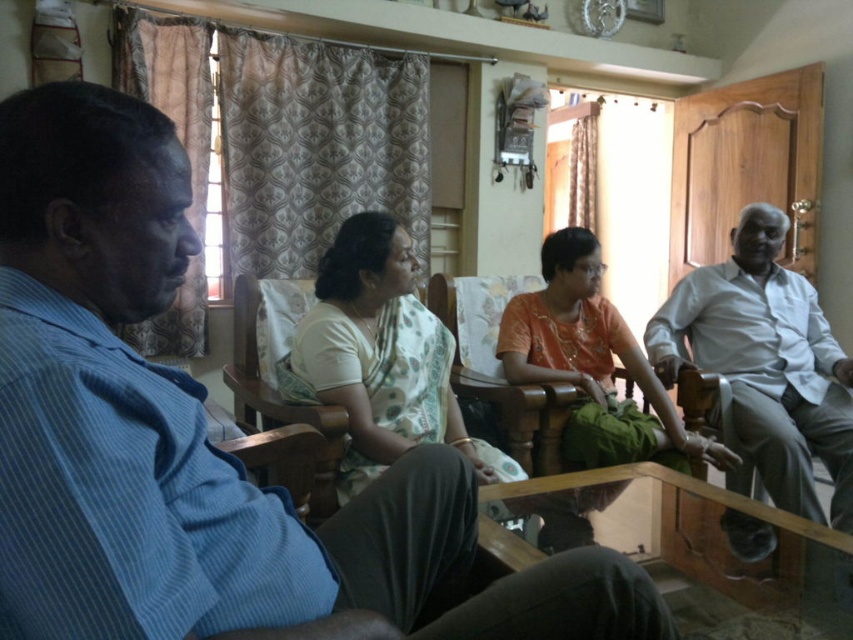
You are sitting at the table and want to hand a document to both the blue striped shirt at left and the white cotton shirt at right. Which person should you hand the document to first to ensure you can reach them without moving from your seat?

You should hand the document to the blue striped shirt at left first because they are closer to you than the white cotton shirt at right, making them easier to reach without moving.

You are a tailor who needs to determine which shirt requires more fabric for a similar design. Based on the image, which shirt between the blue striped shirt at left and the white cotton shirt at right would need more fabric?

The white cotton shirt at right requires more fabric because its width is greater than the blue striped shirt at left.